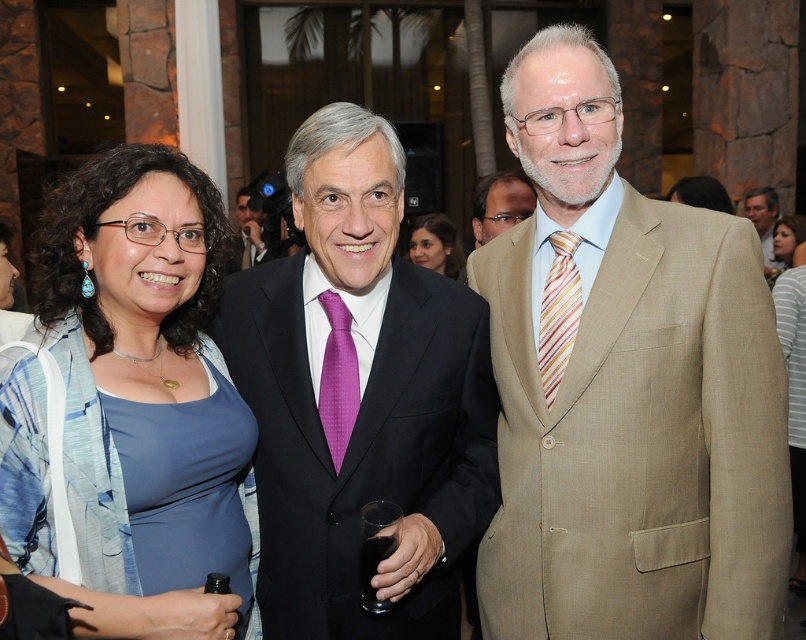
Question: In this image, where is tan textured suit at center located relative to smooth skin face at center?

Choices:
 (A) below
 (B) above

Answer: (A)

Question: From the image, what is the correct spatial relationship of tan textured suit at center in relation to matte brown suit at center?

Choices:
 (A) right
 (B) left

Answer: (A)

Question: Considering the real-world distances, which object is closest to the purple satin tie at center?

Choices:
 (A) light brown textured suit at center
 (B) matte brown suit at center
 (C) smooth skin face at center

Answer: (B)

Question: Which of these objects is positioned closest to the matte black dress at center?

Choices:
 (A) matte black suit at center
 (B) purple satin tie at center

Answer: (B)

Question: Is matte black suit at center to the left of light brown textured suit at center from the viewer's perspective?

Choices:
 (A) yes
 (B) no

Answer: (A)

Question: Which object is farther from the camera taking this photo?

Choices:
 (A) purple satin tie at center
 (B) striped silk tie at center

Answer: (A)